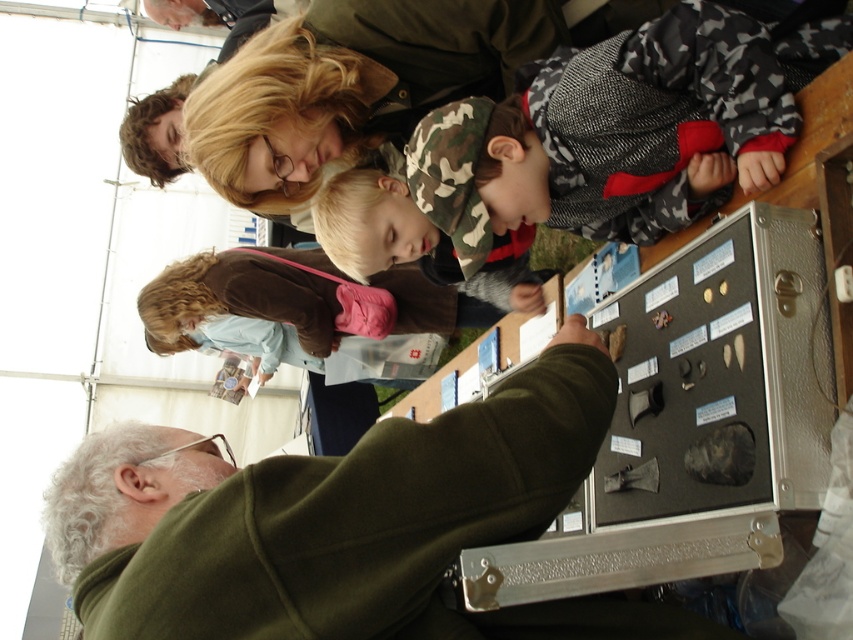
You are a tour guide standing at the display case. You need to hand out a brochure to both the person in the green matte jacket at center and the person holding the brown suede purse at upper left. Can you reach both without moving from your current position?

The green matte jacket at center and the brown suede purse at upper left are 13.20 feet apart. Since the distance between them is over 13 feet, you would need to move to reach both from your current position at the display case.

You are standing at the center of the image. Where is the green matte jacket at center located in relation to your current position?

The green matte jacket at center is located at point (320, 512) in the image.

You are standing at the point labeled as point (x=281, y=513) and want to move to the display case. Is there enough space for you to walk directly to the display case without needing to move any objects?

The distance between you and the display case is 5.82 feet, so there is sufficient space to walk directly to the display case without needing to move any objects.